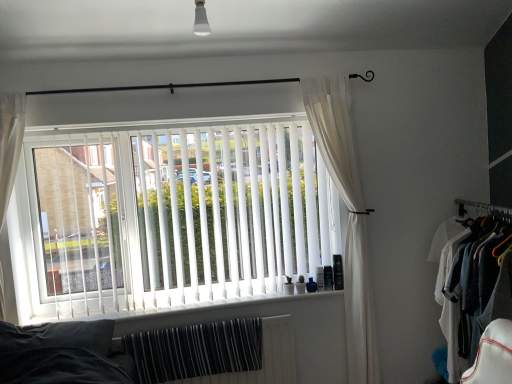
Question: Considering the positions of point (275, 79) and point (212, 319), is point (275, 79) closer or farther from the camera than point (212, 319)?

Choices:
 (A) farther
 (B) closer

Answer: (B)

Question: From a real-world perspective, is black metal rod at upper center above or below white plastic window sill at center?

Choices:
 (A) below
 (B) above

Answer: (B)

Question: Based on their relative distances, which object is nearer to the white vertical blinds at center?

Choices:
 (A) white sheer curtain at right
 (B) white plastic window sill at center
 (C) black metal rod at upper center
 (D) white striped radiator at lower center
 (E) white cotton shirt at right

Answer: (B)

Question: Which object is the closest to the white vertical blinds at center?

Choices:
 (A) white sheer curtain at right
 (B) white plastic window sill at center
 (C) white striped radiator at lower center
 (D) black metal rod at upper center
 (E) white cotton shirt at right

Answer: (B)